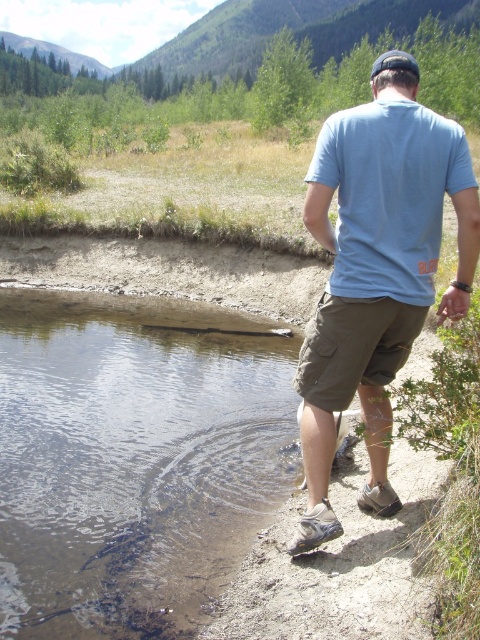
You are a photographer trying to capture the person walking along the water. You want to focus on the point at coordinates (x=376, y=269). Which part of the person should you focus on to ensure the point is in the frame?

The point at coordinates (x=376, y=269) is on the light blue cotton shirt at upper right, so focusing on the upper right part of the person will ensure the point is in the frame.